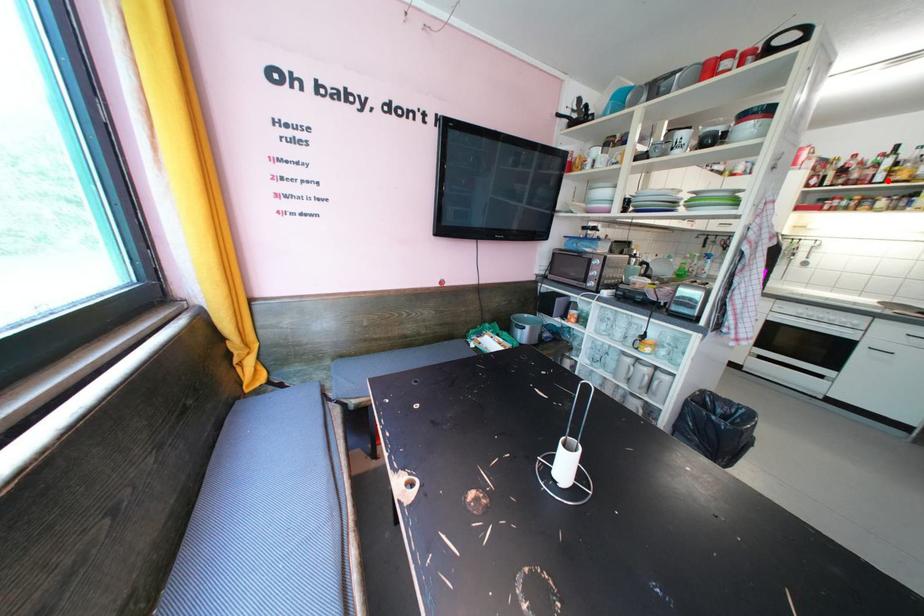
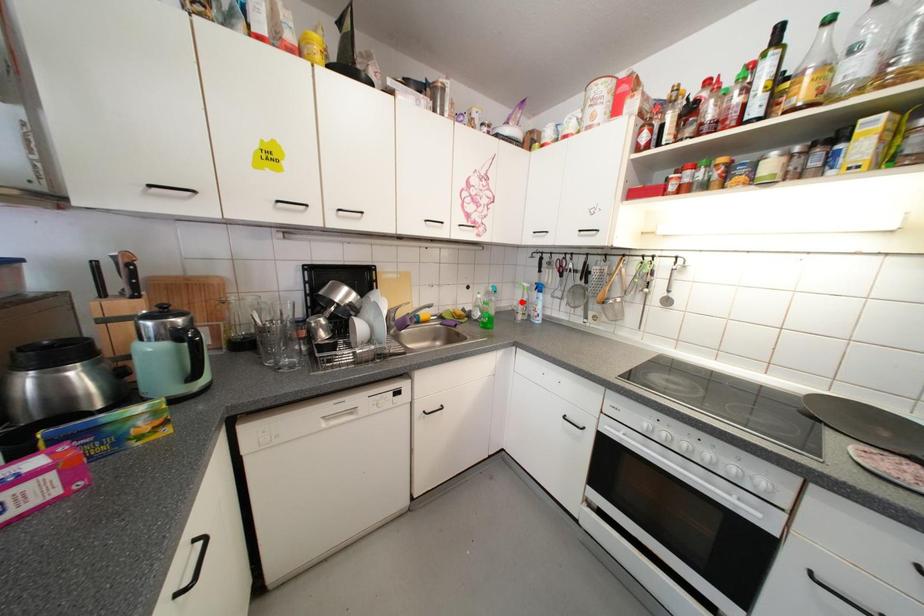
I am providing you with two images of the same scene from different viewpoints. A red point is marked on the first image and another point is marked on the second image. Are the points marked in image1 and image2 representing the same 3D position?

No